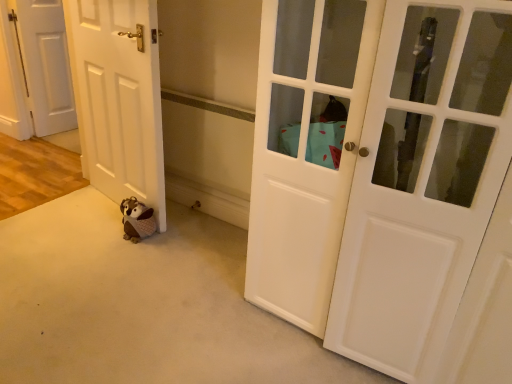
Locate an element on the screen. This screenshot has width=512, height=384. free space to the left of white matte door at left, arranged as the second door when viewed from the front is located at coordinates 56,219.